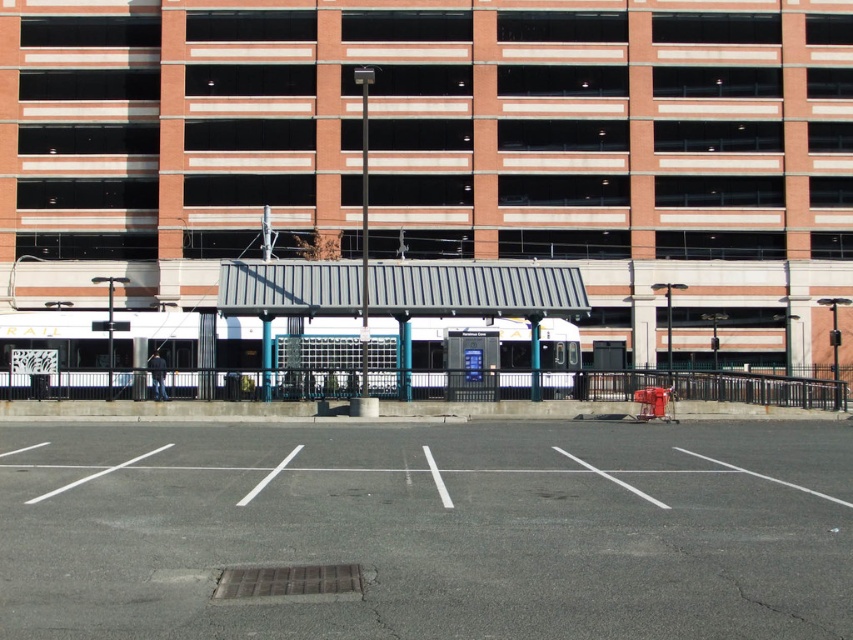
Does brick parking garage at center have a greater width compared to gray asphalt parking lot at center?

Indeed, brick parking garage at center has a greater width compared to gray asphalt parking lot at center.

This screenshot has height=640, width=853. Describe the element at coordinates (444, 150) in the screenshot. I see `brick parking garage at center` at that location.

Between point (693, 248) and point (387, 570), which one is positioned in front?

Point (387, 570)

Where is `brick parking garage at center`? brick parking garage at center is located at coordinates (444, 150).